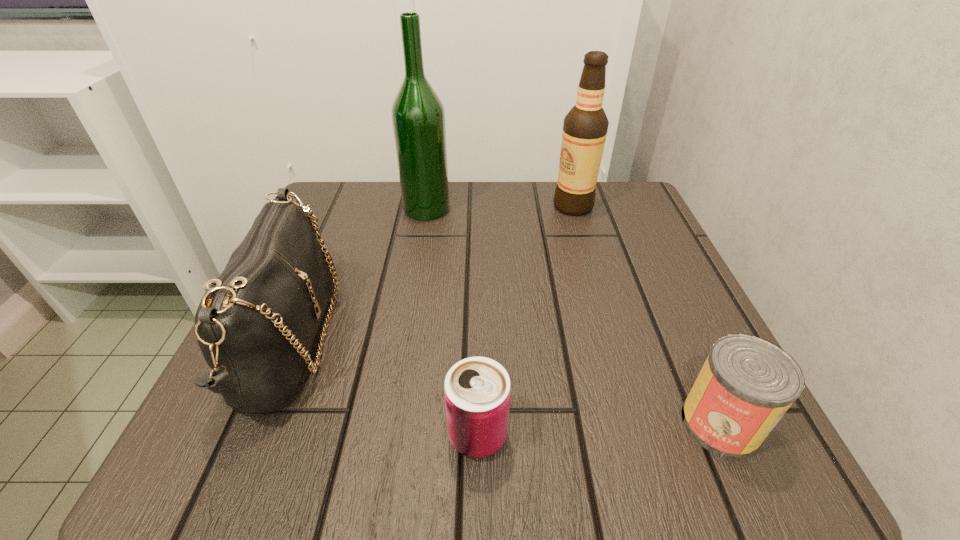
In order to click on object at the far right corner in this screenshot , I will do `click(585, 127)`.

Locate an element on the screen. object situated at the near right corner is located at coordinates (746, 385).

In the image, there is a desktop. In order to click on vacant space at the far edge in this screenshot , I will do `click(472, 199)`.

This screenshot has width=960, height=540. I want to click on vacant region at the near edge of the desktop, so click(572, 463).

I want to click on vacant space at the left edge of the desktop, so click(x=358, y=261).

Locate an element on the screen. vacant space at the right edge of the desktop is located at coordinates (647, 324).

The width and height of the screenshot is (960, 540). I want to click on vacant space at the far left corner of the desktop, so click(369, 229).

The height and width of the screenshot is (540, 960). In order to click on free space at the near left corner of the desktop in this screenshot , I will do `click(309, 434)`.

Locate an element on the screen. This screenshot has width=960, height=540. vacant space at the far right corner of the desktop is located at coordinates (598, 187).

At what (x,y) coordinates should I click in order to perform the action: click on vacant space at the near right corner of the desktop. Please return your answer as a coordinate pair (x, y). This screenshot has width=960, height=540. Looking at the image, I should click on (670, 444).